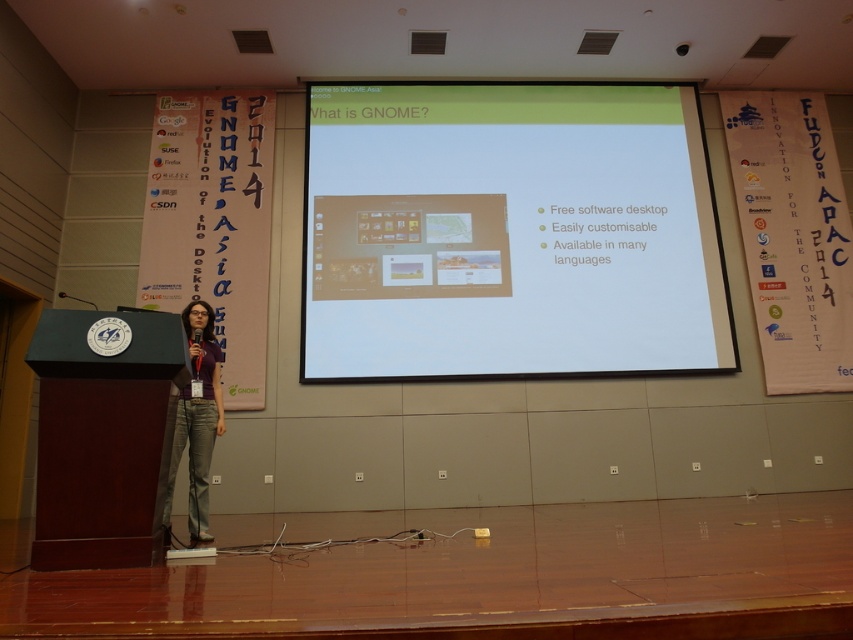
Who is lower down, dark wood podium at center or matte purple shirt at center?

dark wood podium at center is below.

Does point (142, 522) come farther from viewer compared to point (210, 444)?

No, it is in front of (210, 444).

Does point (51, 310) come in front of point (210, 381)?

Yes, point (51, 310) is closer to viewer.

Image resolution: width=853 pixels, height=640 pixels. Find the location of `dark wood podium at center`. dark wood podium at center is located at coordinates (103, 438).

Does white matte projector screen at center appear over dark wood podium at center?

Yes, white matte projector screen at center is above dark wood podium at center.

Looking at this image, measure the distance between white matte projector screen at center and camera.

They are 6.53 meters apart.

Is point (457, 198) behind point (125, 541)?

Yes, it is.

Identify the location of white matte projector screen at center. This screenshot has width=853, height=640. (509, 232).

Does white matte projector screen at center have a lesser height compared to matte purple shirt at center?

No.

Is white matte projector screen at center taller than matte purple shirt at center?

Yes.

Image resolution: width=853 pixels, height=640 pixels. Identify the location of white matte projector screen at center. (509, 232).

Where is `white matte projector screen at center`? white matte projector screen at center is located at coordinates (509, 232).